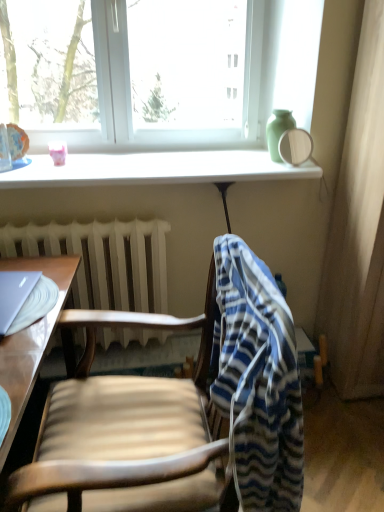
Question: Is transparent glass mirror at upper right oriented away from blue striped fabric at center?

Choices:
 (A) yes
 (B) no

Answer: (B)

Question: From a real-world perspective, is transparent glass mirror at upper right physically below blue striped fabric at center?

Choices:
 (A) no
 (B) yes

Answer: (A)

Question: From a real-world perspective, is transparent glass mirror at upper right on blue striped fabric at center?

Choices:
 (A) yes
 (B) no

Answer: (A)

Question: Does transparent glass mirror at upper right have a smaller size compared to blue striped fabric at center?

Choices:
 (A) no
 (B) yes

Answer: (B)

Question: Would you say transparent glass mirror at upper right is a long distance from blue striped fabric at center?

Choices:
 (A) no
 (B) yes

Answer: (B)

Question: Is point (59, 298) positioned closer to the camera than point (230, 54)?

Choices:
 (A) farther
 (B) closer

Answer: (B)

Question: From their relative heights in the image, would you say light brown wooden desk at left is taller or shorter than white plastic window at upper center?

Choices:
 (A) tall
 (B) short

Answer: (A)

Question: From the image's perspective, is light brown wooden desk at left located above or below white plastic window at upper center?

Choices:
 (A) below
 (B) above

Answer: (A)

Question: From a real-world perspective, is light brown wooden desk at left physically located above or below white plastic window at upper center?

Choices:
 (A) below
 (B) above

Answer: (A)

Question: Considering the positions of wooden chair at center and light brown wooden desk at left in the image, is wooden chair at center taller or shorter than light brown wooden desk at left?

Choices:
 (A) tall
 (B) short

Answer: (A)

Question: Is point (243, 364) closer or farther from the camera than point (13, 361)?

Choices:
 (A) farther
 (B) closer

Answer: (B)

Question: In the image, is wooden chair at center on the left side or the right side of light brown wooden desk at left?

Choices:
 (A) left
 (B) right

Answer: (B)

Question: Is wooden chair at center bigger or smaller than light brown wooden desk at left?

Choices:
 (A) small
 (B) big

Answer: (B)

Question: Is white plastic window at upper center spatially inside white glossy window sill at upper center, or outside of it?

Choices:
 (A) inside
 (B) outside

Answer: (B)

Question: Based on their positions, is white plastic window at upper center located to the left or right of white glossy window sill at upper center?

Choices:
 (A) left
 (B) right

Answer: (A)